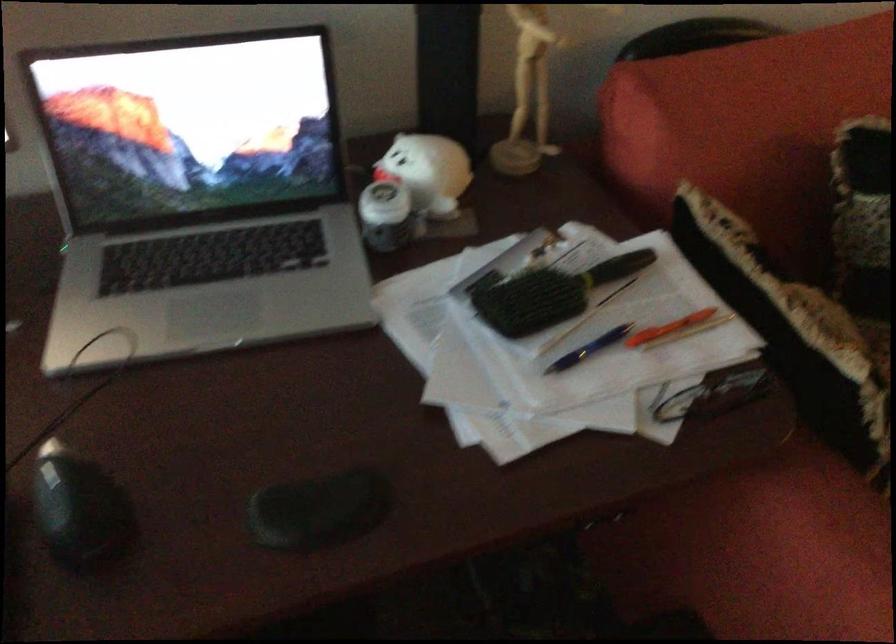
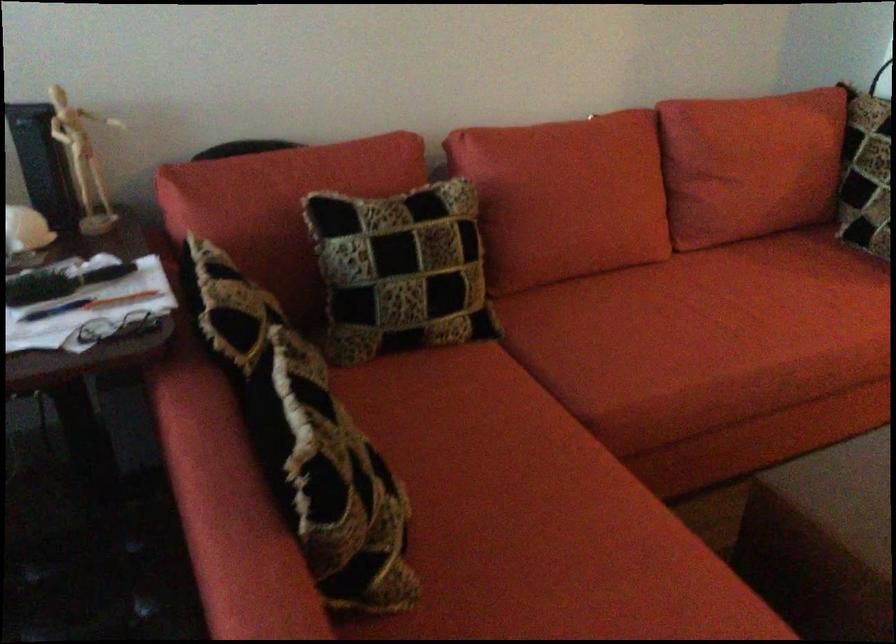
In the second image, find the point that corresponds to [743,219] in the first image.

(261, 263)